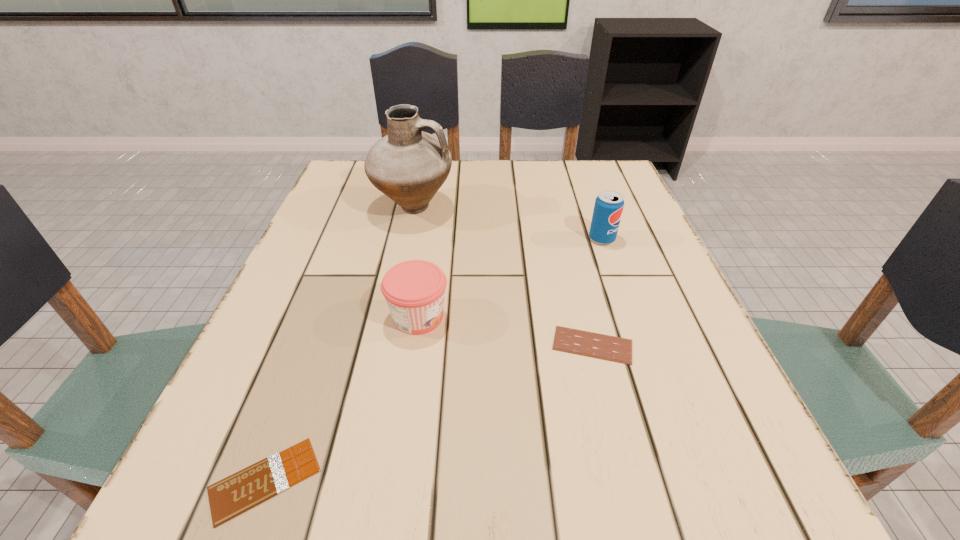
The image size is (960, 540). Find the location of `free space that satisfies the following two spatial constraints: 1. on the handle side of the tallest object; 2. on the back side of the soda can`. free space that satisfies the following two spatial constraints: 1. on the handle side of the tallest object; 2. on the back side of the soda can is located at coordinates (407, 239).

Find the location of a particular element. The height and width of the screenshot is (540, 960). vacant point that satisfies the following two spatial constraints: 1. on the handle side of the pitcher; 2. on the right side of the soda can is located at coordinates pyautogui.click(x=407, y=239).